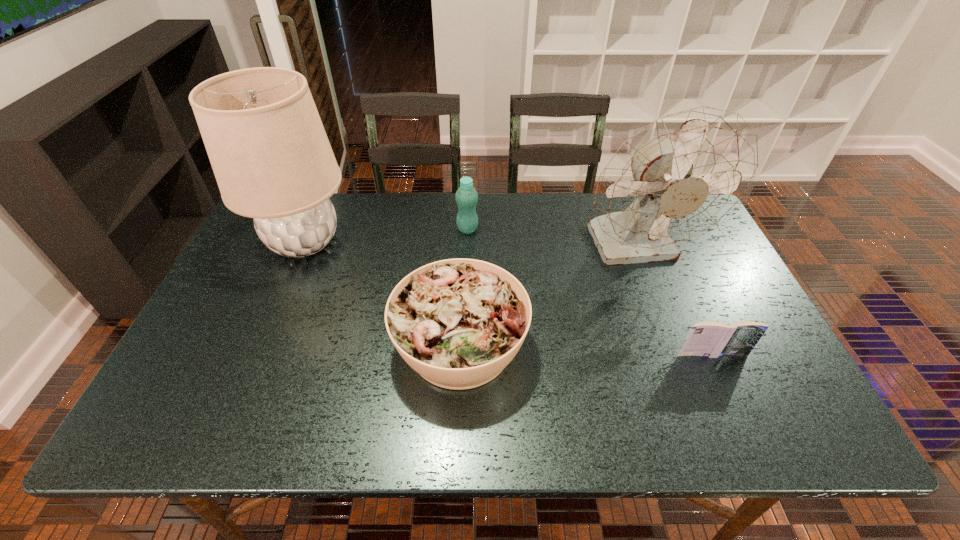
You are a GUI agent. You are given a task and a screenshot of the screen. Output one action in this format:
    pyautogui.click(x=<x>, y=<y>)
    Task: Click on the fan that is at the far edge
    Image resolution: width=960 pixels, height=540 pixels.
    Given the screenshot: What is the action you would take?
    pyautogui.click(x=683, y=175)

Identify the location of lampshade present at the far edge. This screenshot has width=960, height=540. (272, 160).

Identify the location of water bottle that is at the far edge. (466, 196).

The width and height of the screenshot is (960, 540). What are the coordinates of `object positioned at the near edge` in the screenshot? It's located at (459, 322).

Identify the location of object at the left edge. The image size is (960, 540). (272, 160).

Locate an element on the screen. The image size is (960, 540). fan located in the right edge section of the desktop is located at coordinates (683, 175).

Locate an element on the screen. The image size is (960, 540). book located in the right edge section of the desktop is located at coordinates (709, 339).

Identify the location of object present at the far left corner. The width and height of the screenshot is (960, 540). (272, 160).

Identify the location of object that is positioned at the far right corner. The width and height of the screenshot is (960, 540). (683, 175).

The height and width of the screenshot is (540, 960). I want to click on free space at the far edge of the desktop, so click(583, 197).